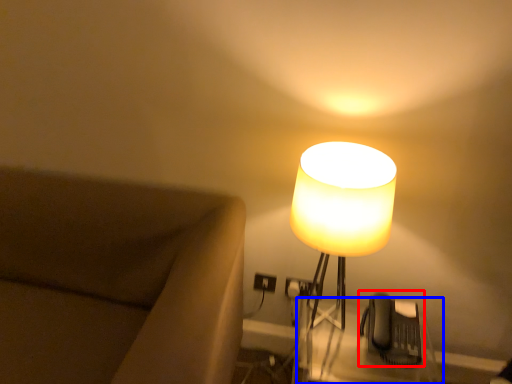
Question: Which object is closer to the camera taking this photo, swivel chair (highlighted by a red box) or table (highlighted by a blue box)?

Choices:
 (A) swivel chair
 (B) table

Answer: (B)